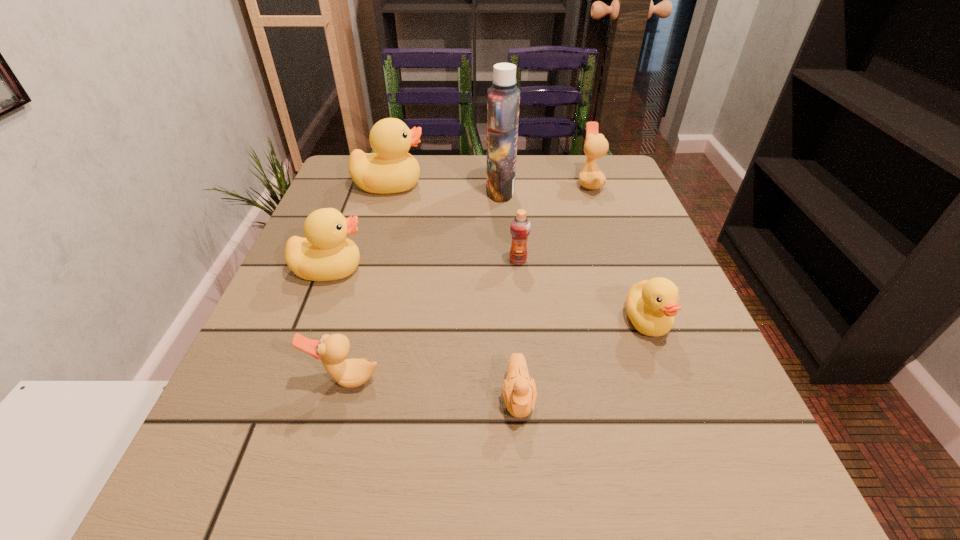
What are the coordinates of `free space located on the beak of the farther tan duck` in the screenshot? It's located at (420, 183).

Where is `vacant space located 0.360m on the beak of the farther tan duck`? vacant space located 0.360m on the beak of the farther tan duck is located at coordinates (433, 183).

Identify the location of vacant region located 0.190m on the right of the orange juice. The width and height of the screenshot is (960, 540). coord(622,260).

The image size is (960, 540). Identify the location of vacant space situated 0.230m at the beak of the nearest yellow duck. (x=710, y=489).

Identify the location of vacant space situated on the beak of the smaller tan duck. (322, 466).

Find the location of `vacant space located 0.090m on the face of the duckling`. vacant space located 0.090m on the face of the duckling is located at coordinates (525, 494).

Locate an element on the screen. This screenshot has height=540, width=960. shampoo that is at the far edge is located at coordinates (503, 98).

Where is `object situated at the far left corner`? This screenshot has width=960, height=540. object situated at the far left corner is located at coordinates (x=390, y=169).

Find the location of a particular element. This screenshot has width=960, height=540. object present at the far right corner is located at coordinates (596, 146).

Where is `free region at the far edge of the desktop`? free region at the far edge of the desktop is located at coordinates (419, 199).